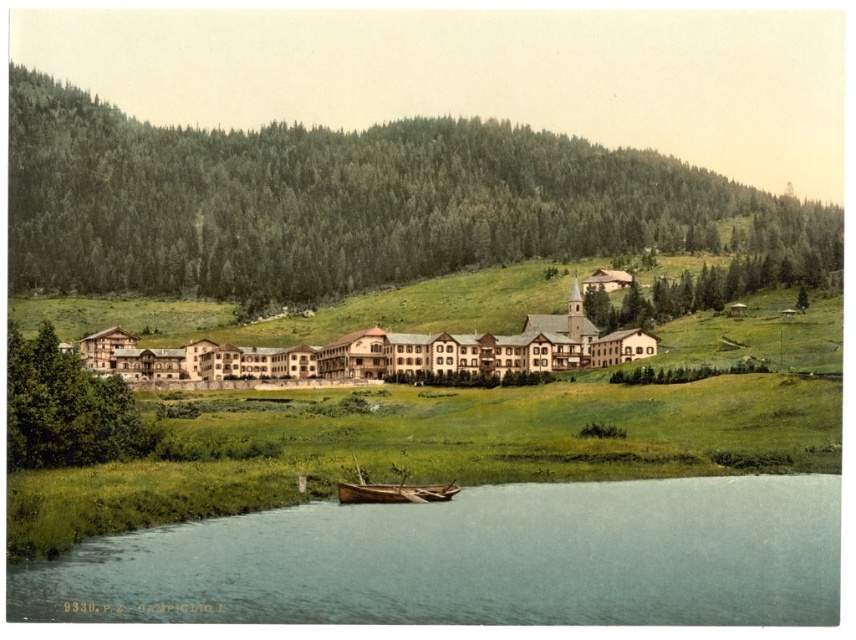
What is located at the coordinates point (348, 204) in the image?

The coordinates point (348, 204) in the image are occupied by green textured trees at center.

You are standing at the center of the image and want to locate the green textured tree at upper right. In which direction should you look to find it?

You should look towards the upper right direction to find the green textured tree at upper right, as it is located at point coordinates of (739, 268).

You are planning to take a photo of the wooden boat at lower center and the green textured trees at center. Based on their sizes, which object should you focus on first to ensure both are in frame?

The green textured trees at center are bigger than the wooden boat at lower center, so you should focus on the green textured trees at center first to ensure both fit in the frame.